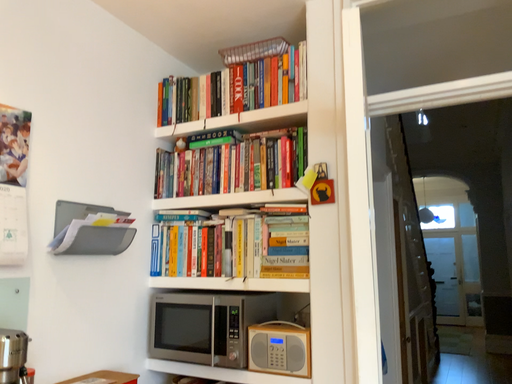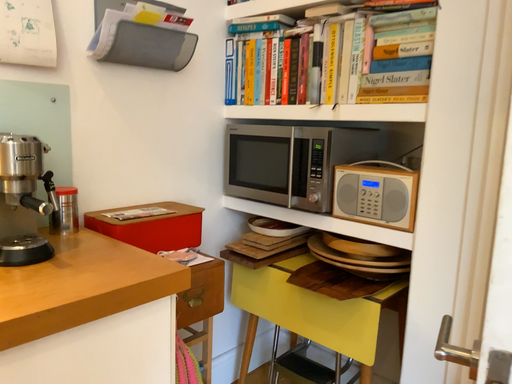
Question: Which way did the camera rotate in the video?

Choices:
 (A) rotated upward
 (B) rotated downward

Answer: (B)